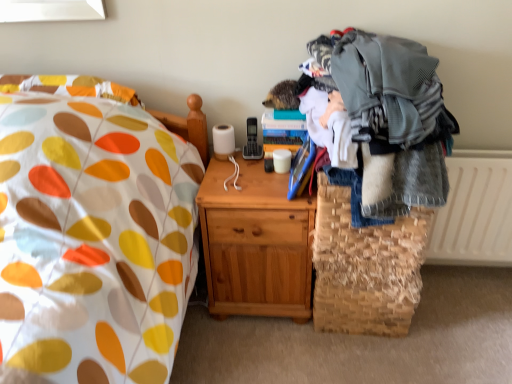
Where is `blank space situated above white textured radiator at right (from a real-world perspective)`? blank space situated above white textured radiator at right (from a real-world perspective) is located at coordinates (474, 155).